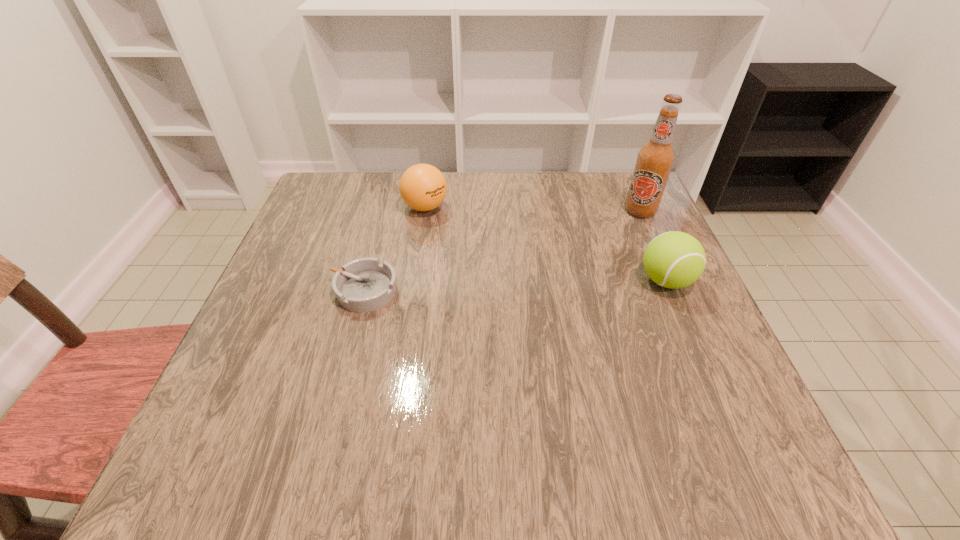
At what (x,y) coordinates should I click in order to perform the action: click on vacant region located on the side with brand of the ping-pong ball. Please return your answer as a coordinate pair (x, y). The image size is (960, 540). Looking at the image, I should click on (495, 321).

You are a GUI agent. You are given a task and a screenshot of the screen. Output one action in this format:
    pyautogui.click(x=<x>, y=<y>)
    Task: Click on the free space located 0.110m on the side with brand of the ping-pong ball
    
    Given the screenshot: What is the action you would take?
    pyautogui.click(x=448, y=245)

You are a GUI agent. You are given a task and a screenshot of the screen. Output one action in this format:
    pyautogui.click(x=<x>, y=<y>)
    Task: Click on the beer bottle present at the far edge
    
    Given the screenshot: What is the action you would take?
    point(655,159)

Image resolution: width=960 pixels, height=540 pixels. I want to click on ping-pong ball present at the far edge, so click(x=423, y=187).

Where is `object at the left edge`? The image size is (960, 540). object at the left edge is located at coordinates (363, 285).

In order to click on tennis ball at the right edge in this screenshot , I will do `click(674, 259)`.

Locate an element on the screen. The height and width of the screenshot is (540, 960). beer bottle that is positioned at the right edge is located at coordinates (655, 159).

Find the location of a particular element. The height and width of the screenshot is (540, 960). object at the far right corner is located at coordinates (655, 159).

This screenshot has height=540, width=960. Identify the location of vacant space at the far edge. (513, 176).

The height and width of the screenshot is (540, 960). In the image, there is a desktop. What are the coordinates of `free space at the near edge` in the screenshot? It's located at (437, 393).